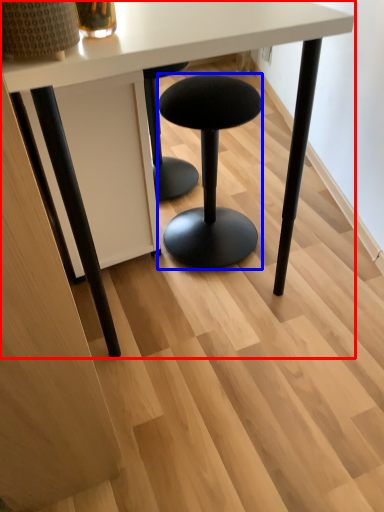
Question: Which point is closer to the camera, table (highlighted by a red box) or stool (highlighted by a blue box)?

Choices:
 (A) table
 (B) stool

Answer: (A)